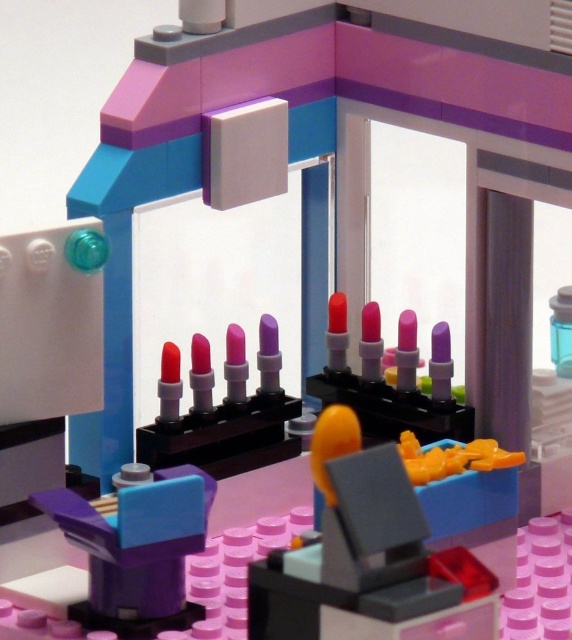
You are a small LEGO figure standing at the point labeled as point (162, 593). You want to move to the point labeled as point (561, 364). Which direction should you go to reach your destination?

To reach point (561, 364) from point (162, 593), you should move backward since point (162, 593) is in front of point (561, 364).

Based on the photo, you are organizing a LEGO display and need to place the purple matte box at lower left and the transparent plastic bottle at upper right. According to the scene, which object is closer to the viewer?

The purple matte box at lower left is closer to the viewer because it is in front of the transparent plastic bottle at upper right.

You are a customer at a LEGO store and want to place the matte plastic lipstick at center into the purple matte box at lower left. Based on the scene description, can you determine if the lipstick will fit inside the box?

The purple matte box at lower left is closer to the viewer than the matte plastic lipstick at center, but the description does not provide information about their sizes or dimensions. Therefore, it is unclear if the matte plastic lipstick at center will fit inside the purple matte box at lower left.